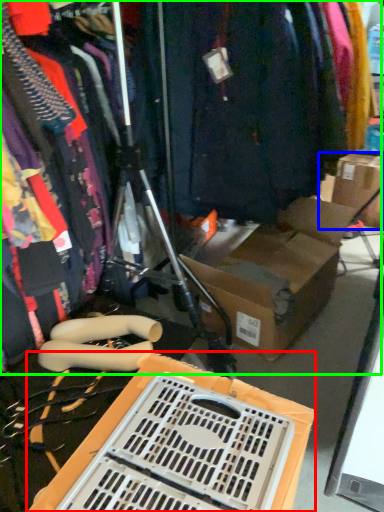
Question: Considering the real-world distances, which object is closest to storage box (highlighted by a red box)? cardboard box (highlighted by a blue box) or closet (highlighted by a green box).

Choices:
 (A) cardboard box
 (B) closet

Answer: (B)